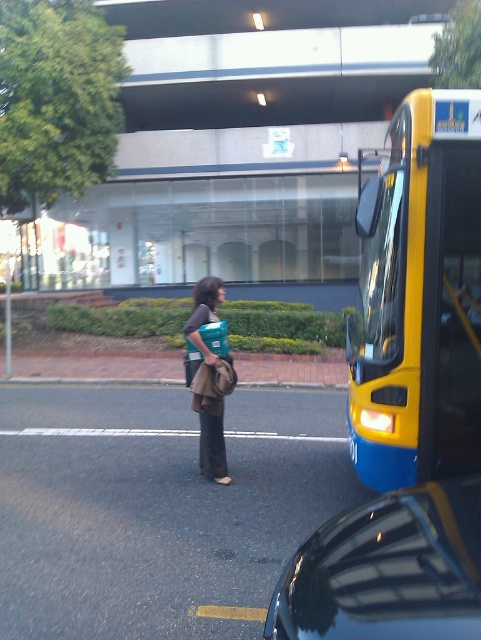
Question: Considering the relative positions of yellow matte bus at right and shiny black car at lower right in the image provided, where is yellow matte bus at right located with respect to shiny black car at lower right?

Choices:
 (A) above
 (B) below

Answer: (A)

Question: Can you confirm if yellow matte bus at right is positioned to the left of shiny black car at lower right?

Choices:
 (A) yes
 (B) no

Answer: (B)

Question: Which point is closer to the camera taking this photo?

Choices:
 (A) (202, 420)
 (B) (423, 616)

Answer: (B)

Question: Does shiny black car at lower right appear on the left side of teal fabric bag at center?

Choices:
 (A) yes
 (B) no

Answer: (B)

Question: Which point appears farthest from the camera in this image?

Choices:
 (A) (414, 577)
 (B) (389, 401)
 (C) (223, 444)

Answer: (C)

Question: Among these points, which one is farthest from the camera?

Choices:
 (A) (396, 476)
 (B) (215, 282)

Answer: (B)